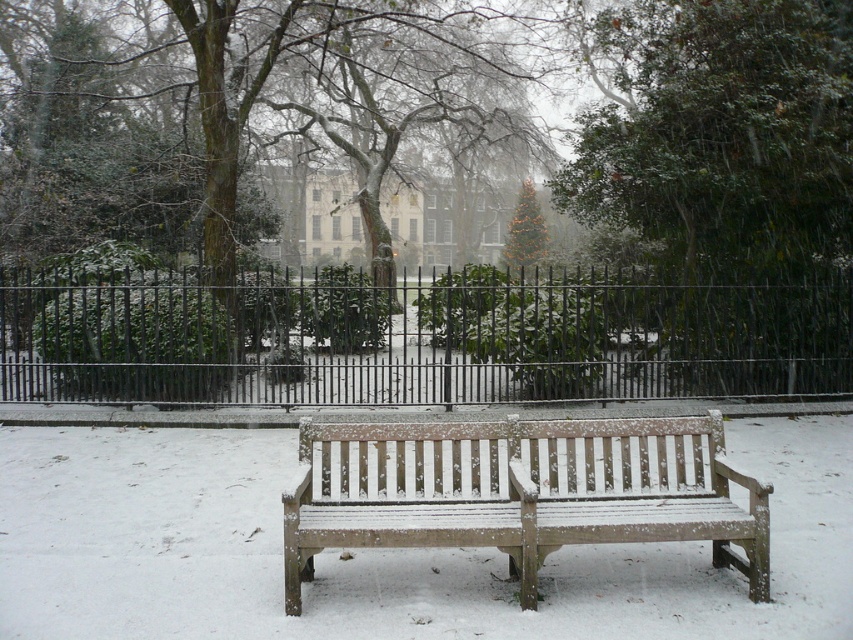
Question: Which object is closer to the camera taking this photo?

Choices:
 (A) snow-covered wood bench at center
 (B) green leafy tree at center
 (C) black metal fence at center

Answer: (A)

Question: Where is green leafy tree at center located in relation to snow-covered wood bench at center in the image?

Choices:
 (A) right
 (B) left

Answer: (A)

Question: Estimate the real-world distances between objects in this image. Which object is farther from the snow-covered wood bench at center?

Choices:
 (A) black metal fence at center
 (B) green leafy tree at center

Answer: (A)

Question: Is black metal fence at center further to camera compared to snow-covered wood bench at center?

Choices:
 (A) no
 (B) yes

Answer: (B)

Question: Which of the following is the farthest from the observer?

Choices:
 (A) green leafy tree at center
 (B) snow-covered wood bench at center
 (C) black metal fence at center

Answer: (C)

Question: Can you confirm if black metal fence at center is thinner than green leafy tree at center?

Choices:
 (A) no
 (B) yes

Answer: (A)